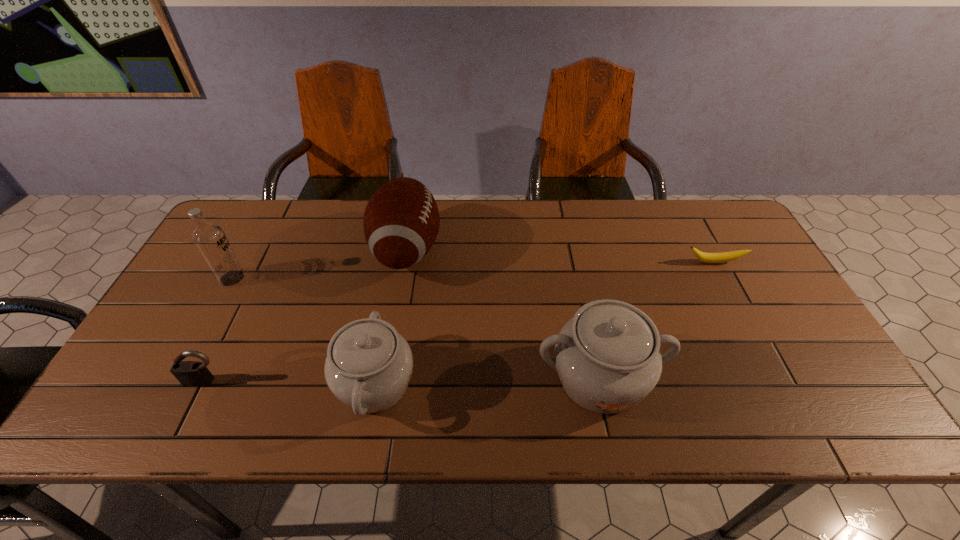
Locate an element on the screen. This screenshot has height=540, width=960. vacant space at the far edge of the desktop is located at coordinates (300, 237).

I want to click on blank space at the near edge, so click(x=417, y=384).

I want to click on free space at the left edge of the desktop, so click(x=175, y=316).

The height and width of the screenshot is (540, 960). What are the coordinates of `vacant region at the right edge of the desktop` in the screenshot? It's located at (767, 303).

This screenshot has height=540, width=960. What are the coordinates of `vacant space at the far right corner` in the screenshot? It's located at (732, 240).

At what (x,y) coordinates should I click in order to perform the action: click on empty space that is in between the football and the third shortest object. Please return your answer as a coordinate pair (x, y). The image size is (960, 540). Looking at the image, I should click on (391, 316).

Find the location of a particular element. Image resolution: width=960 pixels, height=540 pixels. vacant area that lies between the football and the vodka is located at coordinates (320, 264).

Identify the location of vacant area that lies between the football and the right chinaware. The width and height of the screenshot is (960, 540). (503, 314).

This screenshot has height=540, width=960. I want to click on vacant region between the shorter chinaware and the padlock, so click(x=290, y=383).

You are a GUI agent. You are given a task and a screenshot of the screen. Output one action in this format:
    pyautogui.click(x=<x>, y=<y>)
    Task: Click on the free spot between the football and the vodka
    This screenshot has width=960, height=540.
    Given the screenshot: What is the action you would take?
    pyautogui.click(x=320, y=264)